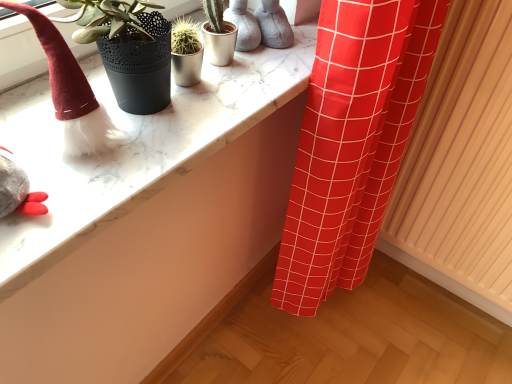
Where is `free location to the left of fuzzy red hat at left`? This screenshot has width=512, height=384. free location to the left of fuzzy red hat at left is located at coordinates (22, 115).